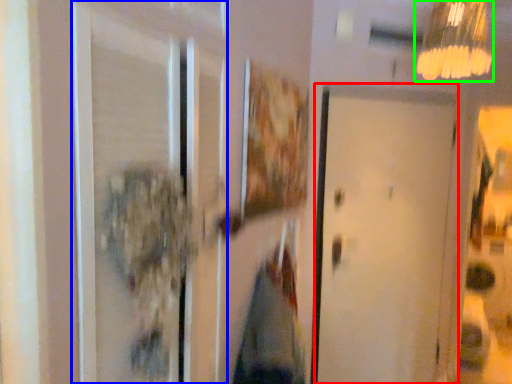
Question: Which is farther away from door (highlighted by a red box)? screen door (highlighted by a blue box) or lamp (highlighted by a green box)?

Choices:
 (A) screen door
 (B) lamp

Answer: (A)